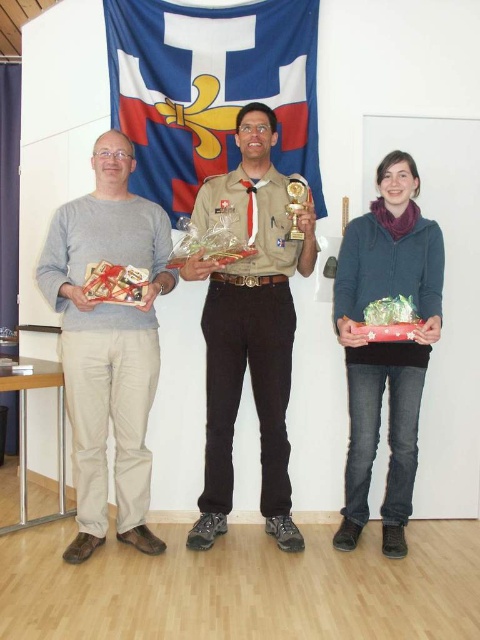
Question: Which object is closer to the camera taking this photo?

Choices:
 (A) gold metallic trophy at center
 (B) blue fabric flag at upper center

Answer: (A)

Question: Does blue fabric flag at upper center lie in front of matte blue sweater at center?

Choices:
 (A) yes
 (B) no

Answer: (B)

Question: Is matte blue sweater at center thinner than gold metallic trophy at center?

Choices:
 (A) yes
 (B) no

Answer: (B)

Question: Which object is farther from the camera taking this photo?

Choices:
 (A) matte blue sweater at center
 (B) gray matte sweater at left
 (C) matte gray sweater at center

Answer: (B)

Question: Can you confirm if brown uniform at center is smaller than gold metallic trophy at center?

Choices:
 (A) yes
 (B) no

Answer: (B)

Question: Which point is closer to the camera taking this photo?

Choices:
 (A) (264, 144)
 (B) (317, 154)

Answer: (A)